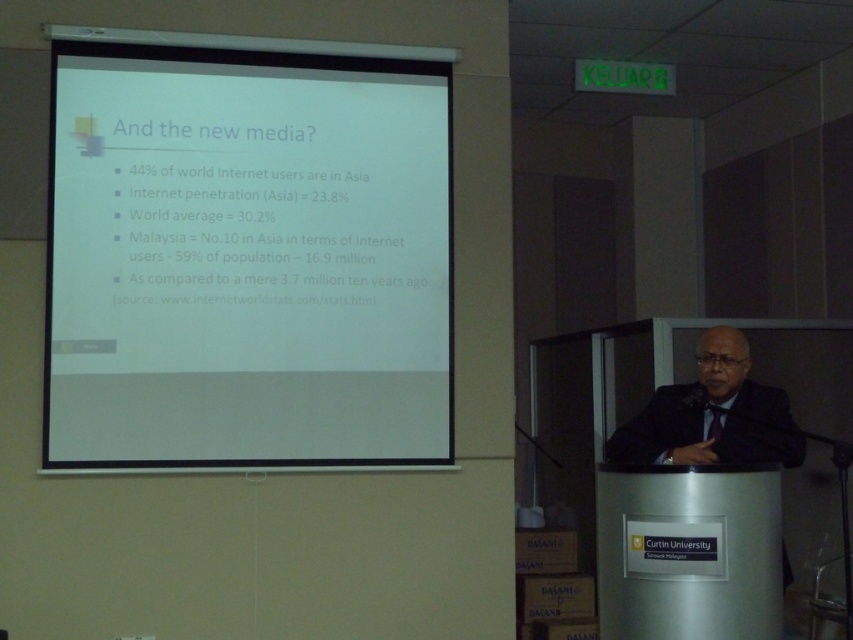
Question: Among these objects, which one is farthest from the camera?

Choices:
 (A) black suit at center
 (B) white matte projector screen at upper center

Answer: (B)

Question: Can you confirm if white matte projector screen at upper center is thinner than black suit at center?

Choices:
 (A) yes
 (B) no

Answer: (B)

Question: Can you confirm if white matte projector screen at upper center is positioned to the right of black suit at center?

Choices:
 (A) yes
 (B) no

Answer: (B)

Question: Which object appears farthest from the camera in this image?

Choices:
 (A) black suit at center
 (B) white matte projector screen at upper center

Answer: (B)

Question: Which object appears closest to the camera in this image?

Choices:
 (A) black suit at center
 (B) white matte projector screen at upper center

Answer: (A)

Question: Is white matte projector screen at upper center thinner than black suit at center?

Choices:
 (A) no
 (B) yes

Answer: (A)